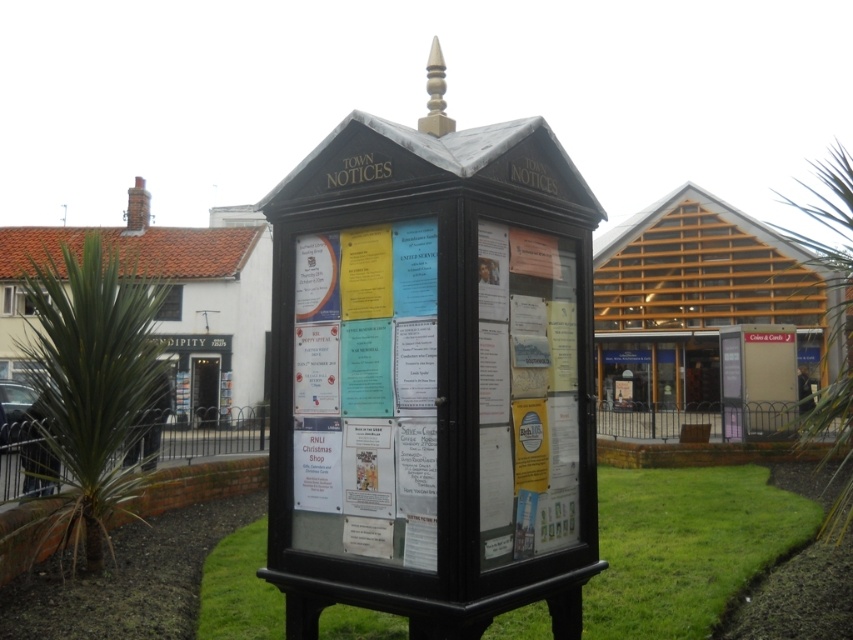
Can you confirm if white paper posters at center is shorter than green grass at lower center?

In fact, white paper posters at center may be taller than green grass at lower center.

Is point (520, 337) farther from viewer compared to point (253, 564)?

That is False.

Is point (363, 244) positioned in front of point (614, 532)?

Yes, it is in front of point (614, 532).

Image resolution: width=853 pixels, height=640 pixels. I want to click on white paper posters at center, so click(369, 388).